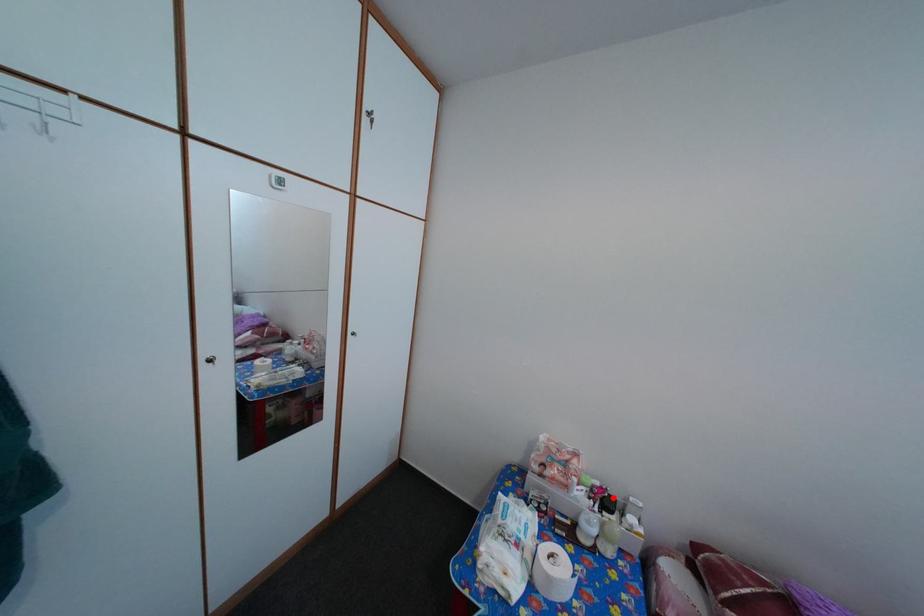
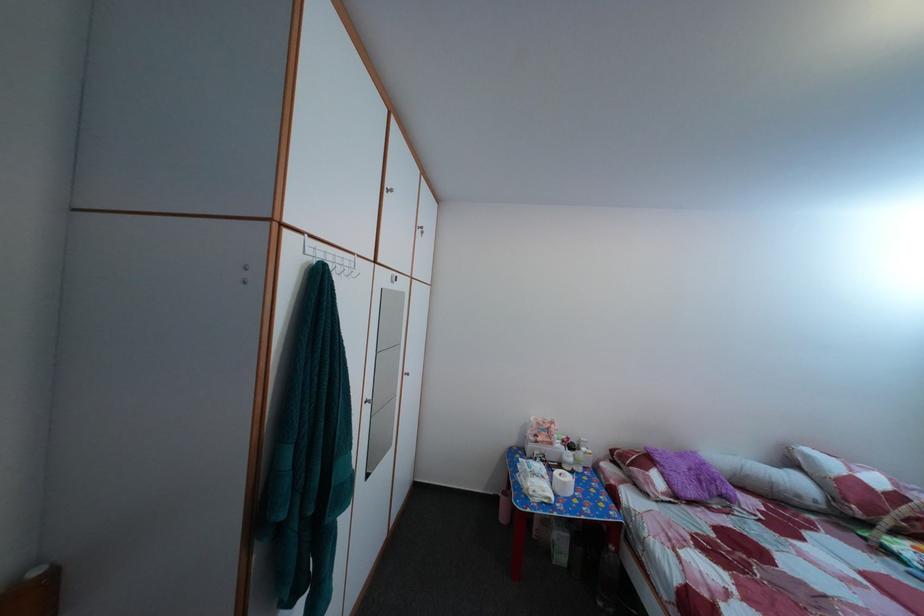
In the second image, find the point that corresponds to the highlighted location in the first image.

(578, 447)